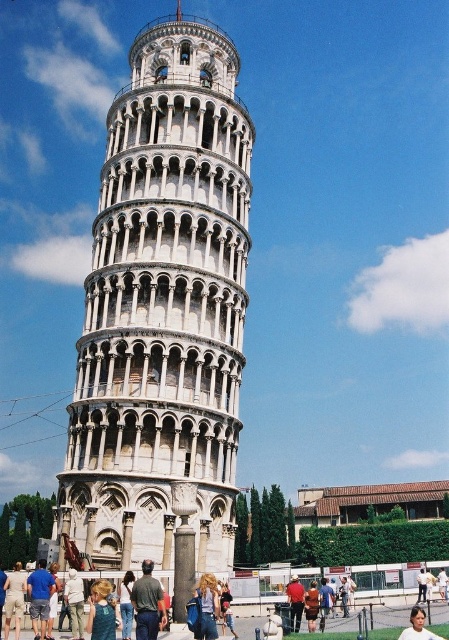
Describe the element at coordinates (294, 602) in the screenshot. I see `red shirt at center` at that location.

Can you confirm if red shirt at center is positioned below white cotton shirt at center?

Indeed, red shirt at center is positioned under white cotton shirt at center.

Is point (294, 600) more distant than point (418, 621)?

Yes, it is.

Where is `red shirt at center`? red shirt at center is located at coordinates (294, 602).

Consider the image. Does white marble tower at center have a lesser height compared to brown leather jacket at center?

In fact, white marble tower at center may be taller than brown leather jacket at center.

Does white marble tower at center appear on the right side of brown leather jacket at center?

Incorrect, white marble tower at center is not on the right side of brown leather jacket at center.

Image resolution: width=449 pixels, height=640 pixels. Identify the location of white marble tower at center. (163, 310).

Where is `white marble tower at center`? white marble tower at center is located at coordinates (163, 310).

Which of these two, blue denim jeans at center or denim jeans at center, stands taller?

Standing taller between the two is denim jeans at center.

Is point (115, 625) closer to camera compared to point (214, 600)?

Yes, it is.

Locate an element on the screen. blue denim jeans at center is located at coordinates (101, 611).

Identify the location of blue denim jeans at center. This screenshot has width=449, height=640. (101, 611).